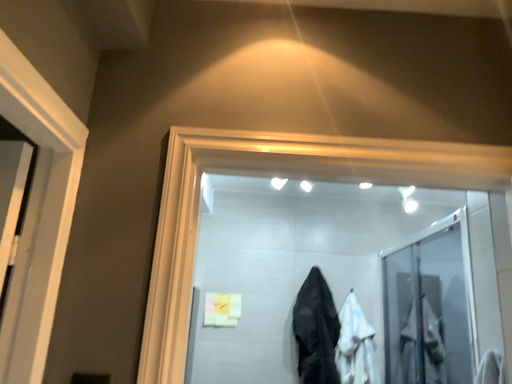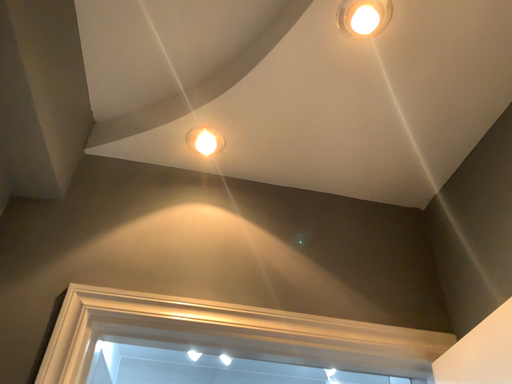
Question: How did the camera likely rotate when shooting the video?

Choices:
 (A) rotated downward
 (B) rotated upward

Answer: (B)